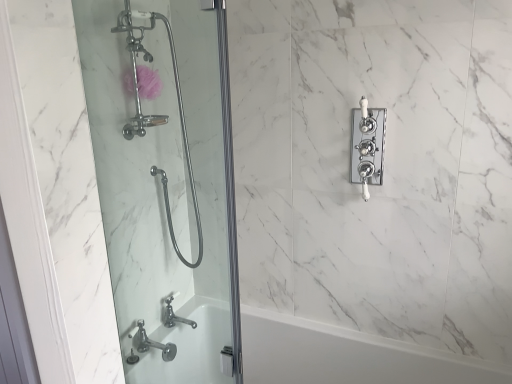
Question: Is white ceramic faucet at upper right at the right side of white glossy bathtub at lower left?

Choices:
 (A) yes
 (B) no

Answer: (A)

Question: Can you confirm if white ceramic faucet at upper right is taller than white glossy bathtub at lower left?

Choices:
 (A) yes
 (B) no

Answer: (B)

Question: Is white ceramic faucet at upper right turned away from white glossy bathtub at lower left?

Choices:
 (A) yes
 (B) no

Answer: (B)

Question: Does white ceramic faucet at upper right have a greater width compared to white glossy bathtub at lower left?

Choices:
 (A) yes
 (B) no

Answer: (B)

Question: Is white glossy bathtub at lower left a part of white ceramic faucet at upper right?

Choices:
 (A) no
 (B) yes

Answer: (A)

Question: From the image's perspective, is white ceramic faucet at upper right located above or below polished chrome faucet at lower left?

Choices:
 (A) above
 (B) below

Answer: (A)

Question: Considering the positions of point (367, 173) and point (178, 321), is point (367, 173) closer or farther from the camera than point (178, 321)?

Choices:
 (A) closer
 (B) farther

Answer: (A)

Question: Is white ceramic faucet at upper right in front of or behind polished chrome faucet at lower left in the image?

Choices:
 (A) front
 (B) behind

Answer: (A)

Question: Visually, is white ceramic faucet at upper right positioned to the left or to the right of polished chrome faucet at lower left?

Choices:
 (A) right
 (B) left

Answer: (A)

Question: Is clear glass shower door at left bigger or smaller than white ceramic faucet at upper right?

Choices:
 (A) big
 (B) small

Answer: (A)

Question: Considering the positions of clear glass shower door at left and white ceramic faucet at upper right in the image, is clear glass shower door at left wider or thinner than white ceramic faucet at upper right?

Choices:
 (A) wide
 (B) thin

Answer: (A)

Question: Is clear glass shower door at left inside the boundaries of white ceramic faucet at upper right, or outside?

Choices:
 (A) outside
 (B) inside

Answer: (A)

Question: In terms of height, does clear glass shower door at left look taller or shorter compared to white ceramic faucet at upper right?

Choices:
 (A) tall
 (B) short

Answer: (A)

Question: Is point (356, 147) closer or farther from the camera than point (183, 312)?

Choices:
 (A) closer
 (B) farther

Answer: (A)

Question: In the image, is white ceramic faucet at upper right on the left side or the right side of clear glass shower door at left?

Choices:
 (A) left
 (B) right

Answer: (B)